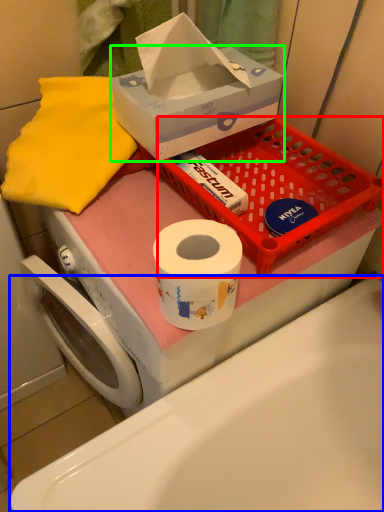
Question: Considering the real-world distances, which object is closest to basket (highlighted by a red box)? bath (highlighted by a blue box) or box (highlighted by a green box).

Choices:
 (A) bath
 (B) box

Answer: (B)